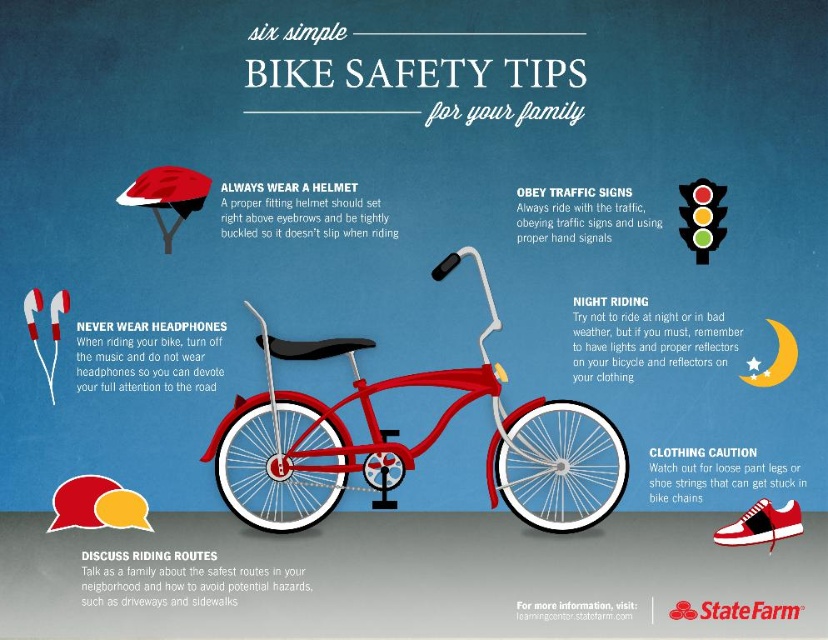
You are standing in front of the infographic and want to locate the shiny metallic bicycle at center. According to the coordinates given, where exactly is it positioned?

The shiny metallic bicycle at center is positioned at coordinates point (414, 444).

You are a safety inspector checking the infographic for accuracy. According to the spatial arrangement, which object is taller between the shiny metallic bicycle at center and the black plastic traffic light at upper right?

The shiny metallic bicycle at center is taller than the black plastic traffic light at upper right according to the description.